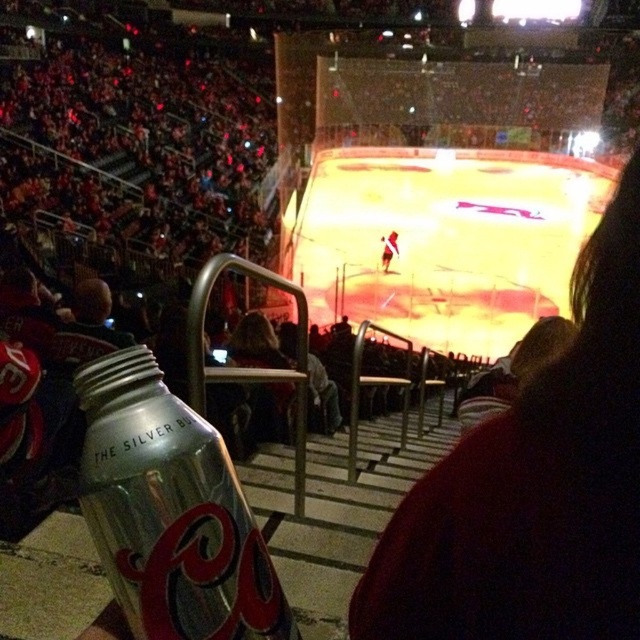
Between dark hair at center and silver metallic can at lower left, which one is positioned lower?

dark hair at center is lower down.

Between dark hair at center and silver metallic can at lower left, which one appears on the left side from the viewer's perspective?

Positioned to the left is silver metallic can at lower left.

This screenshot has width=640, height=640. I want to click on dark hair at center, so click(532, 486).

Locate an element on the screen. dark hair at center is located at coordinates (532, 486).